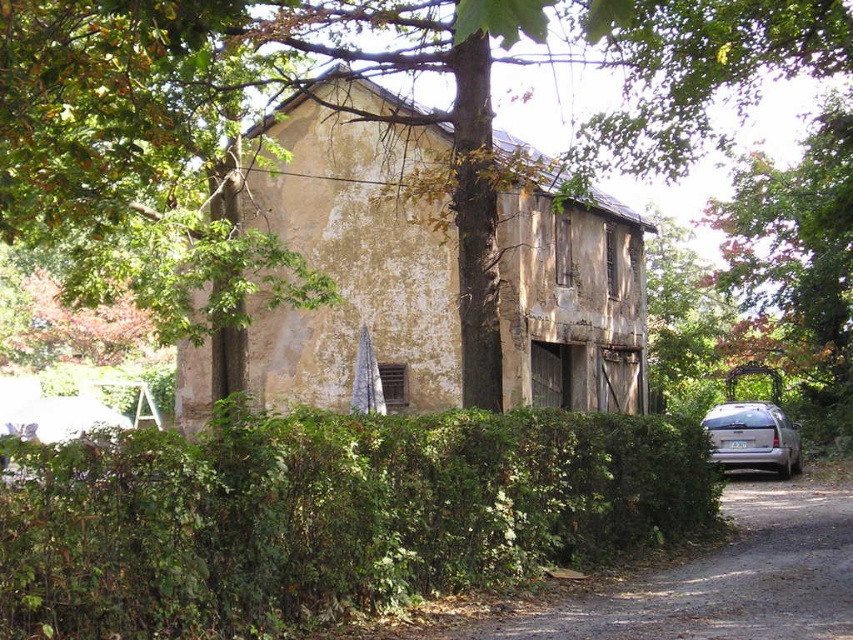
Question: Can you confirm if dirt/gravel driveway at lower right is smaller than green leafy tree at right?

Choices:
 (A) yes
 (B) no

Answer: (A)

Question: Which point is closer to the camera?

Choices:
 (A) silver metallic van at right
 (B) dirt/gravel driveway at lower right

Answer: (B)

Question: Does green leafy hedge at center appear under green leafy tree at right?

Choices:
 (A) no
 (B) yes

Answer: (B)

Question: Which point is farther from the camera taking this photo?

Choices:
 (A) (769, 266)
 (B) (788, 481)

Answer: (A)

Question: Which object appears farthest from the camera in this image?

Choices:
 (A) silver metallic van at right
 (B) dirt/gravel driveway at lower right
 (C) green leafy tree at right

Answer: (A)

Question: Does dirt/gravel driveway at lower right have a smaller size compared to green leafy tree at right?

Choices:
 (A) no
 (B) yes

Answer: (B)